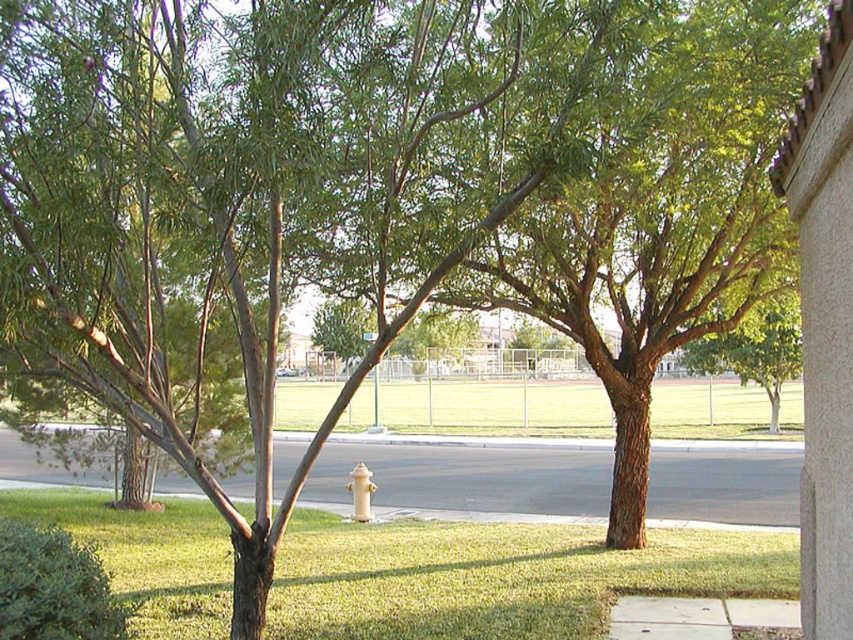
You are a delivery person approaching the yellow matte hydrant at center. As you walk along the white asphalt pavement at center, which object will you encounter first?

You will encounter the white asphalt pavement at center first because it is in front of the yellow matte hydrant at center, meaning the hydrant is behind the pavement from your perspective.

You are a drone operator trying to capture aerial footage of the suburban scene. You need to ensure the camera is focused on the green grass at lower center. According to the coordinates provided, where should the camera be positioned relative to the scene?

The green grass at lower center is located at coordinates point [498,579], so the camera should be positioned at that point to focus on it.

You are a delivery person trying to park your bike near the yellow matte hydrant at center. The parking rules state that you must park on the white asphalt pavement at center. Can you park your bike in a way that places it both near the hydrant and on the designated pavement?

Yes, you can park your bike both near the yellow matte hydrant at center and on the white asphalt pavement at center because the white asphalt pavement at center is located below the hydrant, meaning it is positioned underneath it, allowing the bike to be placed on the pavement close to the hydrant.